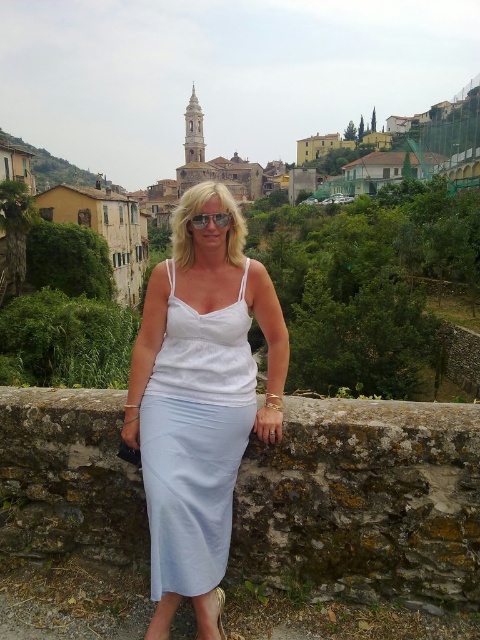
You are a photographer planning to take a photo of the white fabric sandal at lower center while standing on the green grassy hillside at upper left. Considering the distance between them, do you think you can clearly capture the sandal in your shot without zooming in?

The green grassy hillside at upper left is 175.27 meters away from the white fabric sandal at lower center. This distance is quite far, so it would be difficult to capture the sandal clearly without using a zoom lens or moving closer.

You are a fashion designer observing the woman in the image. She is wearing a white sleeveless top and a light blue skirt. You want to suggest an accessory to complement her outfit. Would the transparent plastic goggles at center look better placed above or below the white cotton dress at center?

The transparent plastic goggles at center should be placed above the white cotton dress at center because the white cotton dress at center is below the transparent plastic goggles at center.

You are a photographer setting up for a photoshoot in a village with a historic church tower. You have a white cotton dress at center and transparent plastic goggles at center. Where should you position the model so that the church tower is visible in the background while ensuring the dress and goggles are both in the frame?

Position the model so the white cotton dress at center is to the left of the transparent plastic goggles at center. This arrangement keeps both items in the frame while allowing the church tower in the background to remain visible.